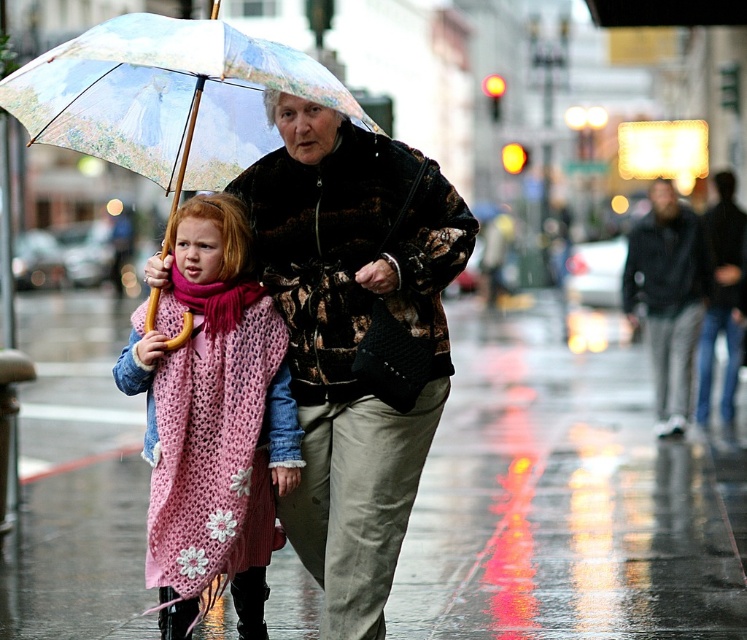
Is floral-patterned coat at center behind pink knitted shawl at left?

Yes, floral-patterned coat at center is behind pink knitted shawl at left.

Which of these two, floral-patterned coat at center or pink knitted shawl at left, stands shorter?

pink knitted shawl at left

Find the location of a particular element. This screenshot has width=747, height=640. floral-patterned coat at center is located at coordinates (353, 337).

Find the location of a particular element. The width and height of the screenshot is (747, 640). floral-patterned coat at center is located at coordinates (353, 337).

Is pink knitted scarf at lower left wider than printed fabric umbrella at center?

Correct, the width of pink knitted scarf at lower left exceeds that of printed fabric umbrella at center.

Does pink knitted scarf at lower left appear on the left side of printed fabric umbrella at center?

Incorrect, pink knitted scarf at lower left is not on the left side of printed fabric umbrella at center.

Looking at this image, who is more distant from viewer, (x=548, y=412) or (x=202, y=168)?

Positioned behind is point (x=548, y=412).

The width and height of the screenshot is (747, 640). I want to click on pink knitted scarf at lower left, so click(x=565, y=499).

Who is more forward, (371, 237) or (353, 108)?

Point (353, 108)

Is floral-patterned coat at center above printed fabric umbrella at center?

Incorrect, floral-patterned coat at center is not positioned above printed fabric umbrella at center.

Locate an element on the screen. floral-patterned coat at center is located at coordinates (353, 337).